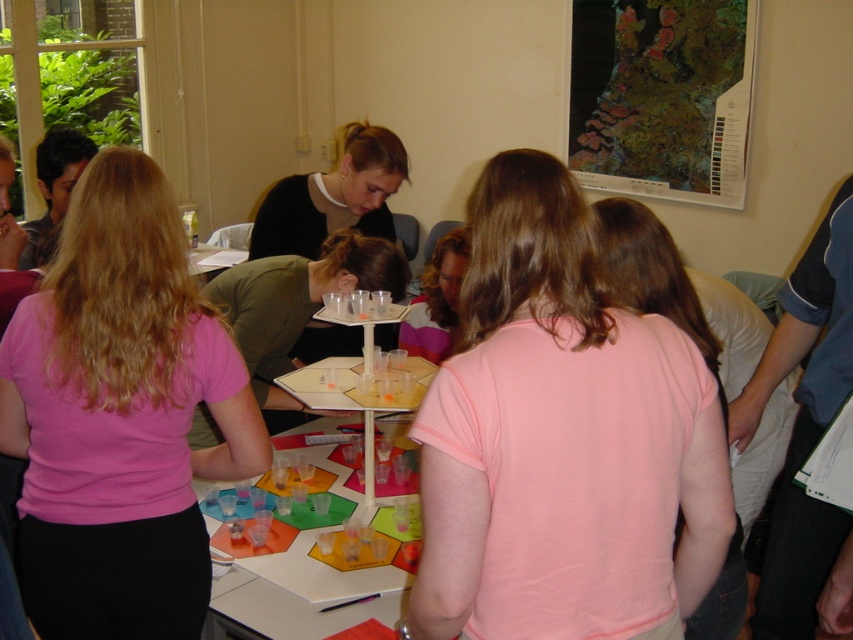
Between point (531, 458) and point (445, 253), which one is positioned behind?

Point (445, 253)

Which is more to the left, pink cotton shirt at center or matte pink shirt at center?

From the viewer's perspective, matte pink shirt at center appears more on the left side.

Image resolution: width=853 pixels, height=640 pixels. What do you see at coordinates (561, 438) in the screenshot?
I see `pink cotton shirt at center` at bounding box center [561, 438].

Where is `pink cotton shirt at center`? The image size is (853, 640). pink cotton shirt at center is located at coordinates (561, 438).

Which is more to the left, translucent plastic cups at center or matte black shirt at center?

matte black shirt at center is more to the left.

The height and width of the screenshot is (640, 853). What are the coordinates of `translucent plastic cups at center` in the screenshot? It's located at (305, 592).

Which is behind, point (549, 568) or point (250, 564)?

The point (250, 564) is behind.

Can you confirm if pink cotton shirt at center is positioned to the left of translucent plastic cups at center?

In fact, pink cotton shirt at center is to the right of translucent plastic cups at center.

Where is `pink cotton shirt at center`? This screenshot has width=853, height=640. pink cotton shirt at center is located at coordinates (561, 438).